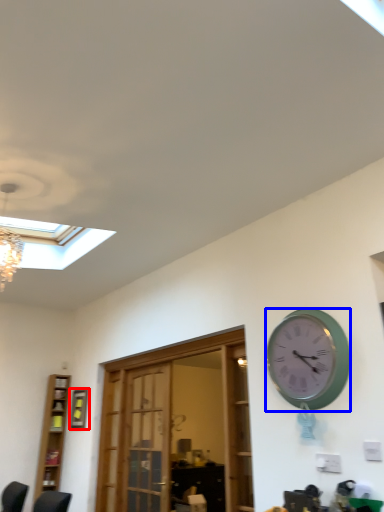
Question: Among these objects, which one is farthest to the camera, picture frame (highlighted by a red box) or wall clock (highlighted by a blue box)?

Choices:
 (A) picture frame
 (B) wall clock

Answer: (A)